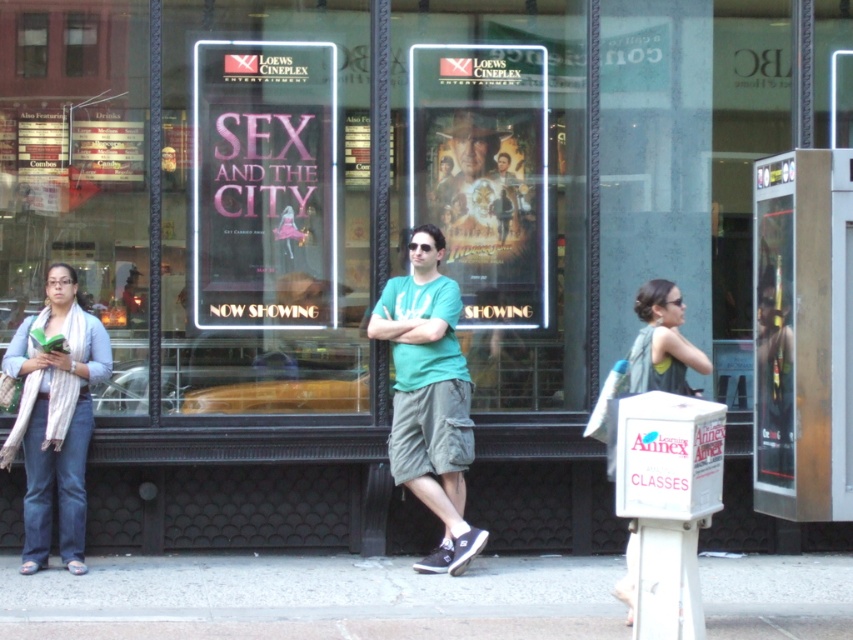
Based on the photo, you are a fashion designer observing the crowd outside the Loews Cineplex. You notice the denim jacket at lower left and the green fabric tank top at center. Which clothing item is located to the left of the other?

The denim jacket at lower left is positioned on the left side of green fabric tank top at center.

You are a photographer standing in front of the Loews Cineplex movie theater. You want to take a photo of the denim jacket at lower left and the green fabric tank top at center. Which object is closer to you?

The denim jacket at lower left is closer to you because it is further to the viewer than the green fabric tank top at center.